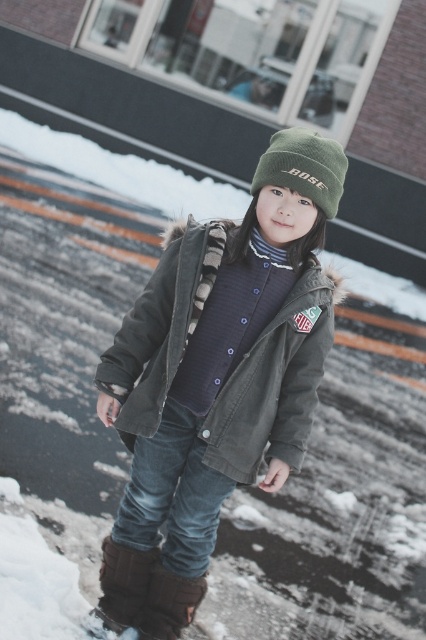
You are a fashion photographer setting up a shoot in a snowy area. You need to position a model wearing an olive corduroy jacket at center and brown suede boot at lower left. According to the scene description, which object should be placed to the right side when arranging them in the frame?

The olive corduroy jacket at center should be placed to the right of the brown suede boot at lower left as per the scene description.